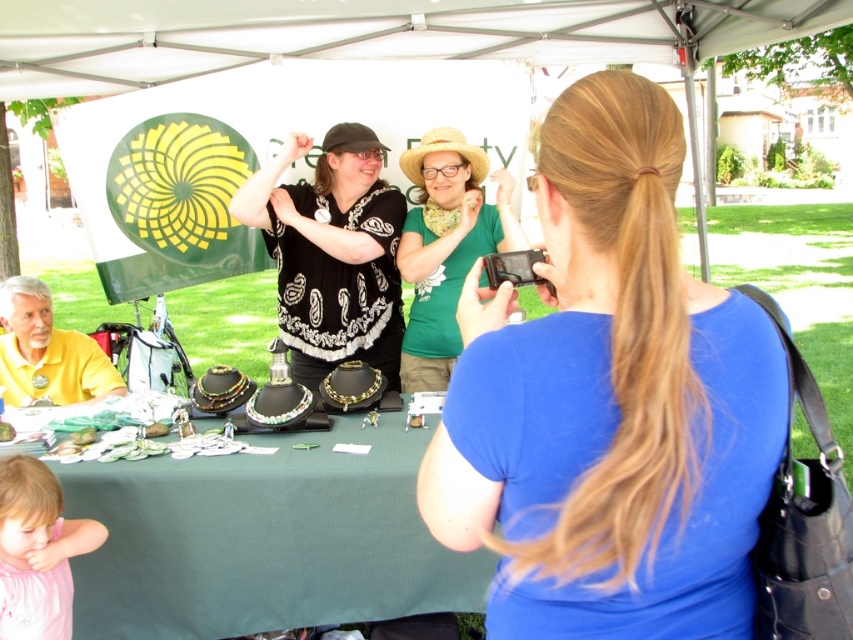
You are standing at the entrance of the canopy tent and want to approach the blue fabric shirt at center. Which direction should you move to reach it?

The blue fabric shirt at center is located at point (610, 401), so you should move towards the center area of the tent to reach it.

You are a photographer at the event and want to ensure both the blue fabric shirt at center and the black paisley blouse at center are fully visible in your photo. Which clothing item might require you to adjust your camera angle to capture its full length?

The blue fabric shirt at center has a lesser height compared to the black paisley blouse at center, so you might need to adjust the camera angle to ensure the taller black paisley blouse at center is fully captured.